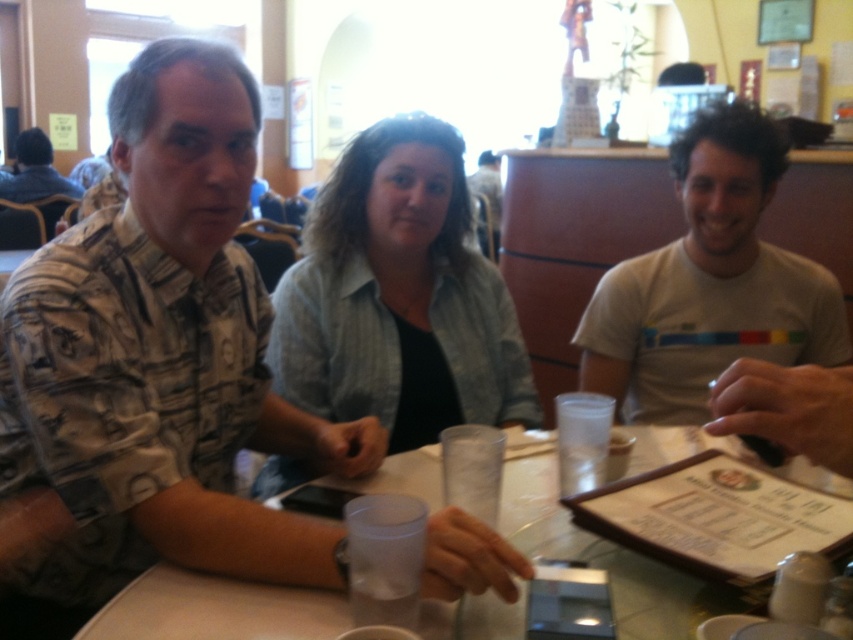
You are a photographer setting up a shoot in this restaurant scene. You need to position a light source so that it illuminates both the printed fabric shirt at left and the denim jacket at upper left equally. Considering their heights, where should you place the light source relative to them?

The printed fabric shirt at left is taller than the denim jacket at upper left, so to ensure equal illumination, the light source should be placed higher above both objects so that the light can reach down to the shorter denim jacket at upper left and still adequately illuminate the taller printed fabric shirt at left.

You are a photographer setting up for a group photo. You need to position the printed fabric shirt at left and the denim jacket at upper left in the frame. Based on their positions, which one should you focus on first to ensure both are in the shot?

The printed fabric shirt at left is located below the denim jacket at upper left, so you should focus on the denim jacket at upper left first to ensure both are in the shot since it is higher up and the lower one will naturally be included if the upper is framed properly.